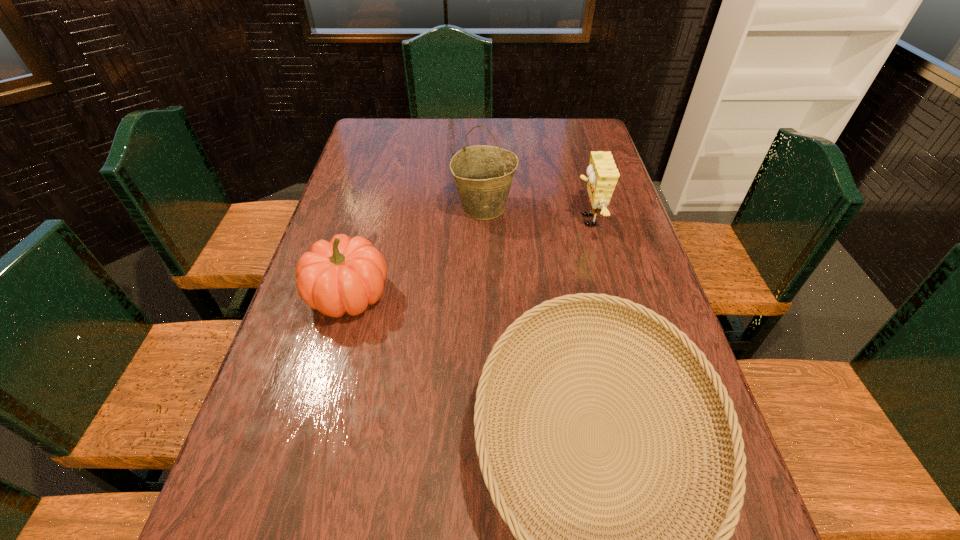
Identify the location of vacant area at the far edge of the desktop. This screenshot has width=960, height=540. (518, 138).

I want to click on vacant region at the left edge of the desktop, so click(353, 151).

In the image, there is a desktop. Where is `vacant space at the far left corner`? This screenshot has width=960, height=540. vacant space at the far left corner is located at coordinates tap(396, 136).

Find the location of a particular element. free spot at the far right corner of the desktop is located at coordinates (568, 137).

Identify the location of vacant point located between the pumpkin and the sponge. (468, 258).

Identify the location of vacant space in between the pumpkin and the sponge. (468, 258).

I want to click on free space between the sponge and the wine bucket, so click(x=536, y=214).

Image resolution: width=960 pixels, height=540 pixels. In order to click on unoccupied area between the pumpkin and the sponge in this screenshot , I will do `click(468, 258)`.

I want to click on empty space between the tallest object and the leftmost object, so click(416, 251).

In order to click on free spot between the sponge and the pumpkin in this screenshot , I will do `click(468, 258)`.